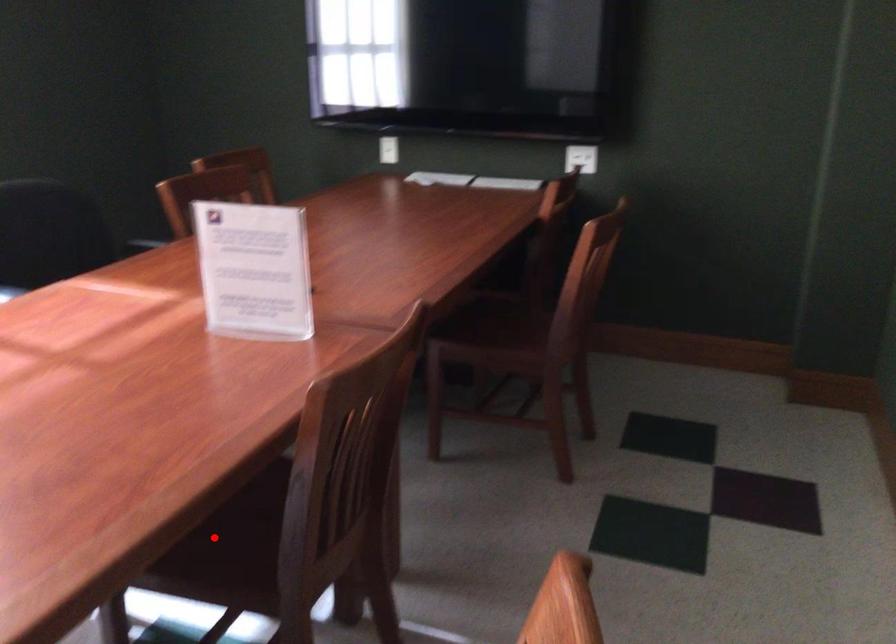
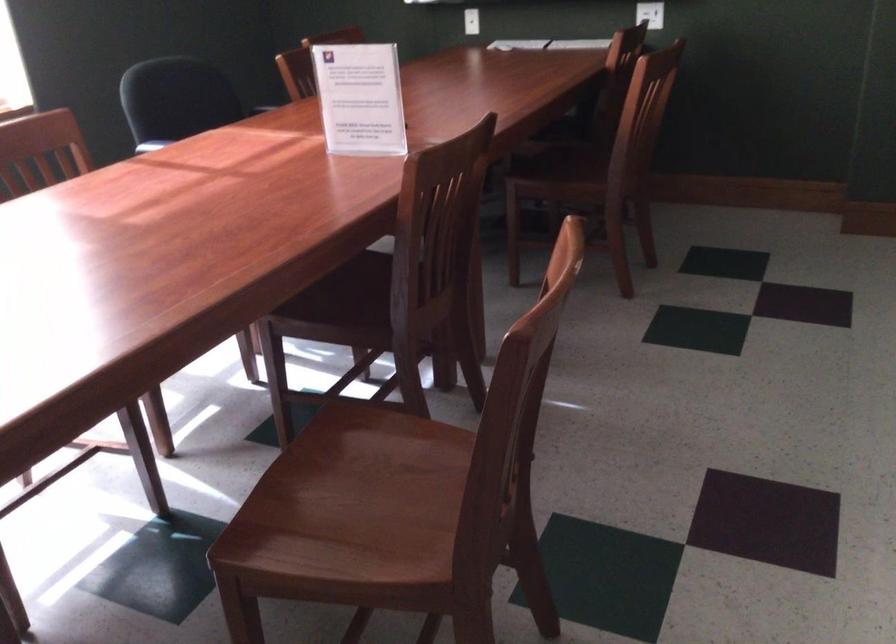
Find the pixel in the second image that matches the highlighted location in the first image.

(340, 301)